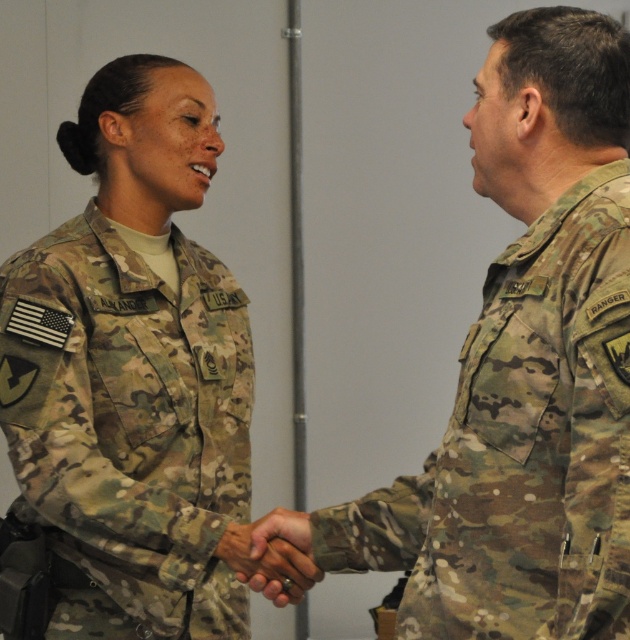
You are a tailor who needs to determine which uniform requires more fabric for a new set of sleeves. Based on the image, which of the two uniforms, the camouflage uniform at right or the camouflage fabric uniform at center, has wider sleeves?

The camouflage uniform at right has wider sleeves than the camouflage fabric uniform at center because its width surpasses the other.

You are a photographer trying to capture the handshake between the two individuals in the image. The camera you are using has a limited field of view. You need to determine if the camouflage uniform at right and the point represented by point (527, 368) are overlapping in the frame. Can you confirm if they are overlapping?

The camouflage uniform at right is represented by point (527, 368), so yes, they are overlapping.

You are a tailor trying to determine which part of the image requires more fabric for a custom replica. Based on the scene, which item has a greater width between the camouflage fabric uniform at center and the camouflage fabric hand at center?

The camouflage fabric uniform at center has a greater width than the camouflage fabric hand at center according to the description.